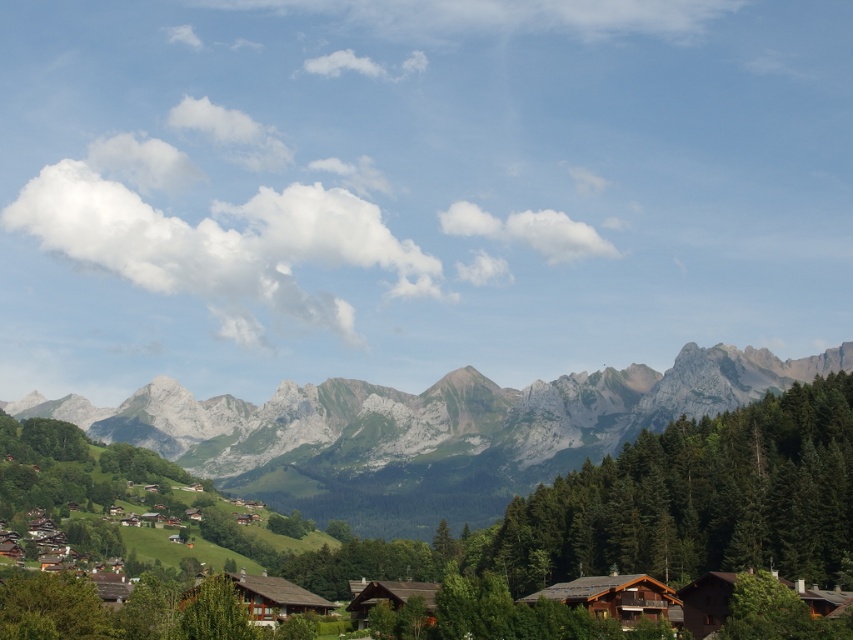
Which of these two, green leafy tree at center or green textured tree at center, stands taller?

Standing taller between the two is green leafy tree at center.

Does green leafy tree at center have a lesser width compared to green textured tree at center?

In fact, green leafy tree at center might be wider than green textured tree at center.

Between point (608, 508) and point (630, 500), which one is positioned behind?

Positioned behind is point (608, 508).

Locate an element on the screen. green leafy tree at center is located at coordinates (659, 508).

Locate an element on the screen. green textured tree at center is located at coordinates (697, 499).

Which is below, green textured tree at center or brown wooden house at lower center?

brown wooden house at lower center

Which is in front, point (602, 548) or point (790, 608)?

Positioned in front is point (790, 608).

You are a GUI agent. You are given a task and a screenshot of the screen. Output one action in this format:
    pyautogui.click(x=<x>, y=<y>)
    Task: Click on the green textured tree at center
    The width and height of the screenshot is (853, 640).
    Given the screenshot: What is the action you would take?
    pyautogui.click(x=697, y=499)

Who is more forward, (x=206, y=586) or (x=547, y=593)?

Point (x=206, y=586) is more forward.

Describe the element at coordinates (242, 604) in the screenshot. I see `brown wooden hut at lower center` at that location.

What are the coordinates of `brown wooden hut at lower center` in the screenshot? It's located at (242, 604).